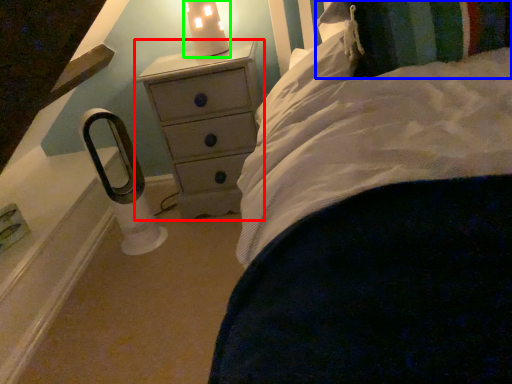
Question: Considering the real-world distances, which object is closest to chest of drawers (highlighted by a red box)? pillow (highlighted by a blue box) or candle holder (highlighted by a green box).

Choices:
 (A) pillow
 (B) candle holder

Answer: (B)